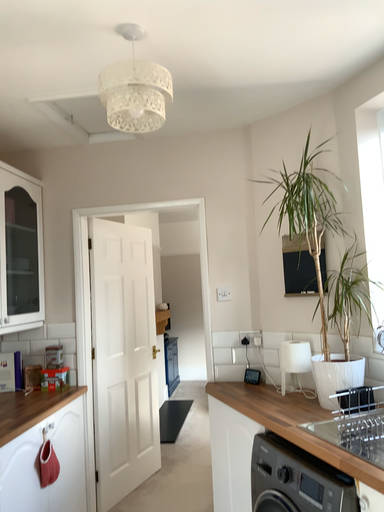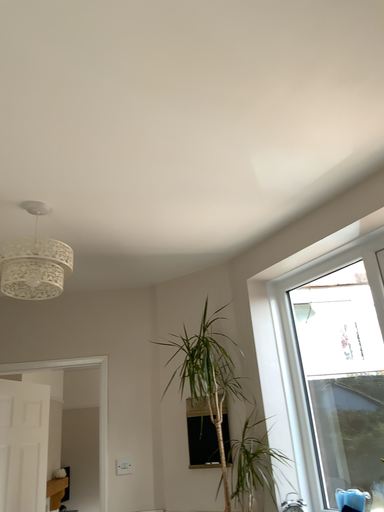
Question: Which way did the camera rotate in the video?

Choices:
 (A) rotated left
 (B) rotated right

Answer: (B)